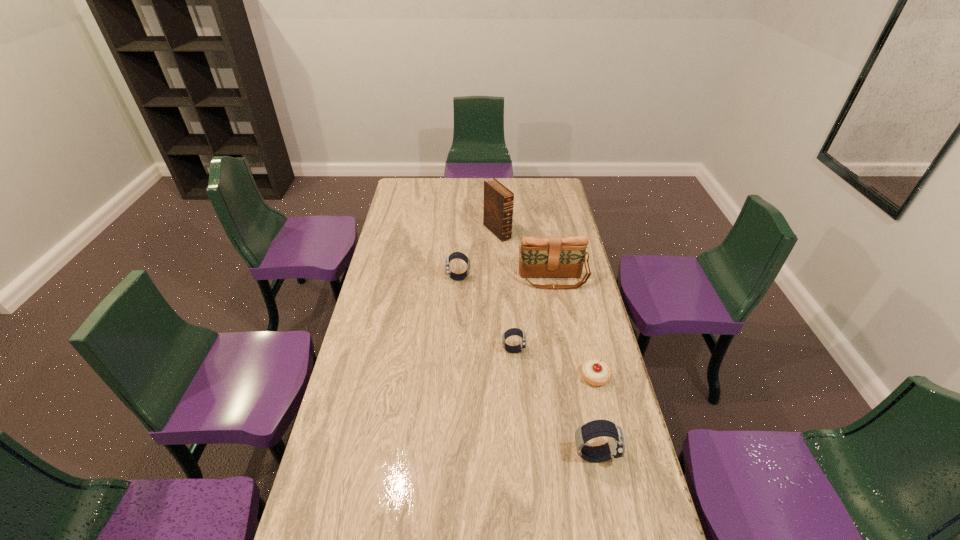
Identify the location of the leftmost watch. This screenshot has height=540, width=960. (456, 255).

Identify the location of the fourth tallest object. Image resolution: width=960 pixels, height=540 pixels. (456, 255).

Find the location of a particular element. The height and width of the screenshot is (540, 960). the second watch from right to left is located at coordinates (513, 331).

Locate an element on the screen. the third nearest object is located at coordinates (513, 331).

Locate an element on the screen. The image size is (960, 540). the tallest watch is located at coordinates (615, 447).

The height and width of the screenshot is (540, 960). Identify the location of the fourth shortest object. (615, 447).

The width and height of the screenshot is (960, 540). Identify the location of the tallest object. (498, 200).

Find the location of a particular element. Bible is located at coordinates (498, 200).

Find the location of a particular element. This screenshot has height=540, width=960. the second tallest object is located at coordinates (540, 257).

Where is `the second nearest object`? The image size is (960, 540). the second nearest object is located at coordinates (595, 372).